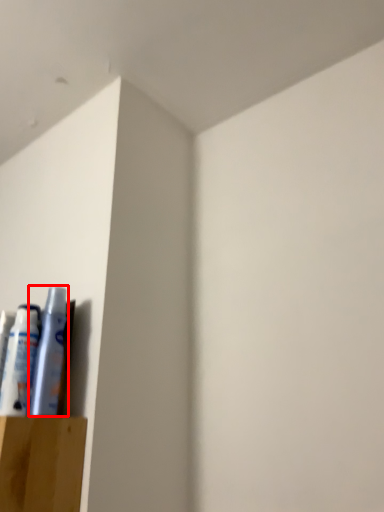
Question: From the image's perspective, considering the relative positions of toiletry (annotated by the red box) and toiletry in the image provided, where is toiletry (annotated by the red box) located with respect to the staircase?

Choices:
 (A) below
 (B) above

Answer: (B)